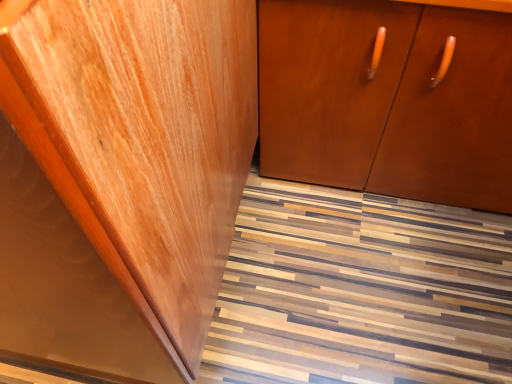
Question: Looking at their shapes, would you say glossy wood cabinet at left, which appears as the 1th cabinetry when viewed from the left, is wider or thinner than matte brown cabinet at center, acting as the first cabinetry starting from the right?

Choices:
 (A) wide
 (B) thin

Answer: (B)

Question: From the image's perspective, is glossy wood cabinet at left, which appears as the 1th cabinetry when viewed from the left, located above or below matte brown cabinet at center, acting as the first cabinetry starting from the right?

Choices:
 (A) above
 (B) below

Answer: (B)

Question: Which object is the farthest from the glossy wood cabinet at left, which appears as the 1th cabinetry when viewed from the left?

Choices:
 (A) wooden floor at lower center
 (B) matte brown cabinet at center, which ranks as the 2th cabinetry in left-to-right order

Answer: (A)

Question: Estimate the real-world distances between objects in this image. Which object is farther from the wooden floor at lower center?

Choices:
 (A) glossy wood cabinet at left, which is the 2th cabinetry from right to left
 (B) matte brown cabinet at center, which ranks as the 2th cabinetry in left-to-right order

Answer: (A)